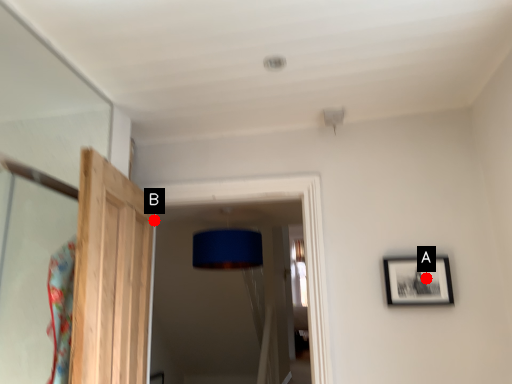
Question: Two points are circled on the image, labeled by A and B beside each circle. Which point appears farthest from the camera in this image?

Choices:
 (A) A is further
 (B) B is further

Answer: (B)